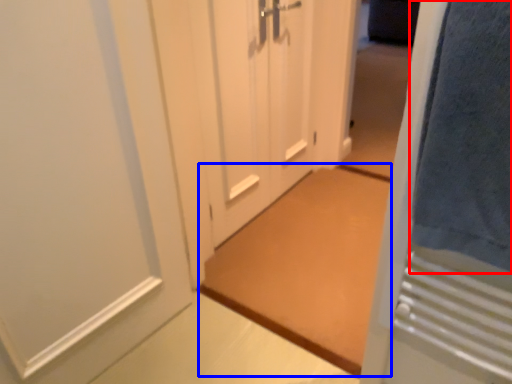
Question: Which point is closer to the camera, bath towel (highlighted by a red box) or doormat (highlighted by a blue box)?

Choices:
 (A) bath towel
 (B) doormat

Answer: (A)